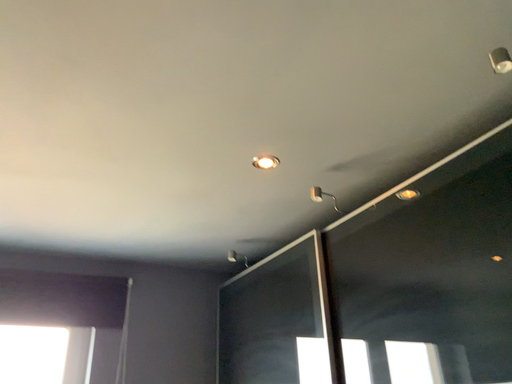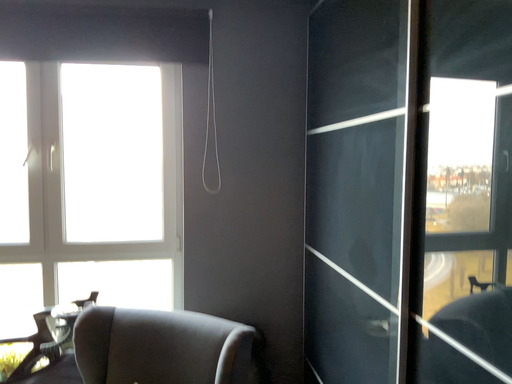
Question: How did the camera likely rotate when shooting the video?

Choices:
 (A) rotated left
 (B) rotated right

Answer: (A)